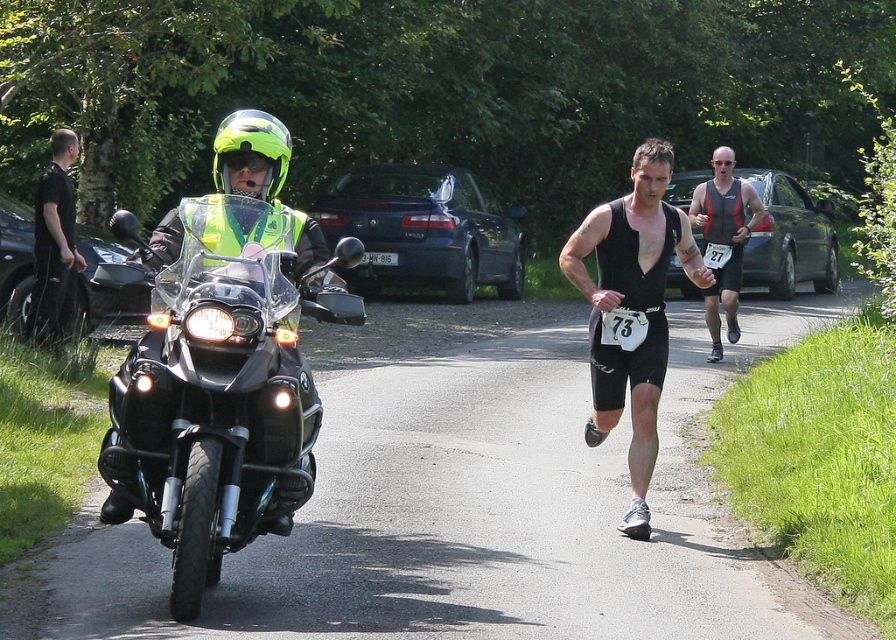
Question: Which point is farther to the camera?

Choices:
 (A) reflective yellow safety vest at center
 (B) black fabric shirt at left
 (C) black mesh tank top at center
 (D) green matte helmet at center

Answer: (A)

Question: From the image, what is the correct spatial relationship of neon yellow matte helmet at left in relation to reflective yellow safety vest at center?

Choices:
 (A) left
 (B) right

Answer: (A)

Question: Estimate the real-world distances between objects in this image. Which object is closer to the black mesh tank top at center?

Choices:
 (A) green matte helmet at center
 (B) black fabric shirt at left
 (C) black matte motorcycle at left
 (D) black matte triathlon suit at center

Answer: (D)

Question: In this image, where is black fabric shirt at left located relative to neon yellow matte helmet at left?

Choices:
 (A) right
 (B) left

Answer: (B)

Question: Can you confirm if black matte motorcycle at left is smaller than black matte triathlon suit at center?

Choices:
 (A) yes
 (B) no

Answer: (B)

Question: Which point is farther to the camera?

Choices:
 (A) (56, 131)
 (B) (281, 515)

Answer: (A)